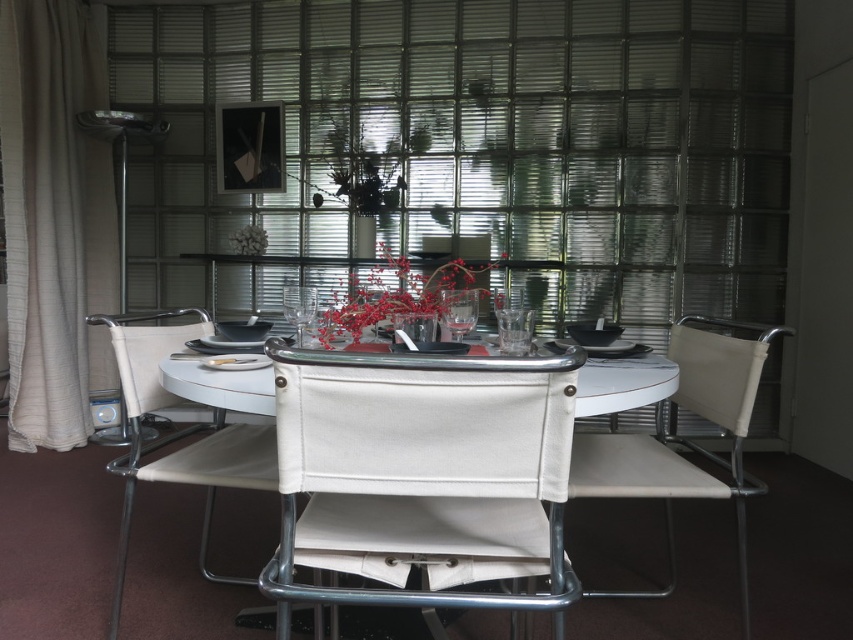
You are a guest at a dinner party and need to place your napkin on the table. The red matte floral arrangement at center is in the way. Where should you place your napkin so it doesn not block the arrangement?

The red matte floral arrangement at center is located at coordinates point (397, 291). You can place your napkin anywhere on the table except at that specific point to avoid blocking it.

You are a guest at this dining table and want to sit down. Which object, the white fabric chair at center or the white matte flower at center, is more suitable for sitting?

The white fabric chair at center is much taller than the white matte flower at center, so the white fabric chair at center is more suitable for sitting.